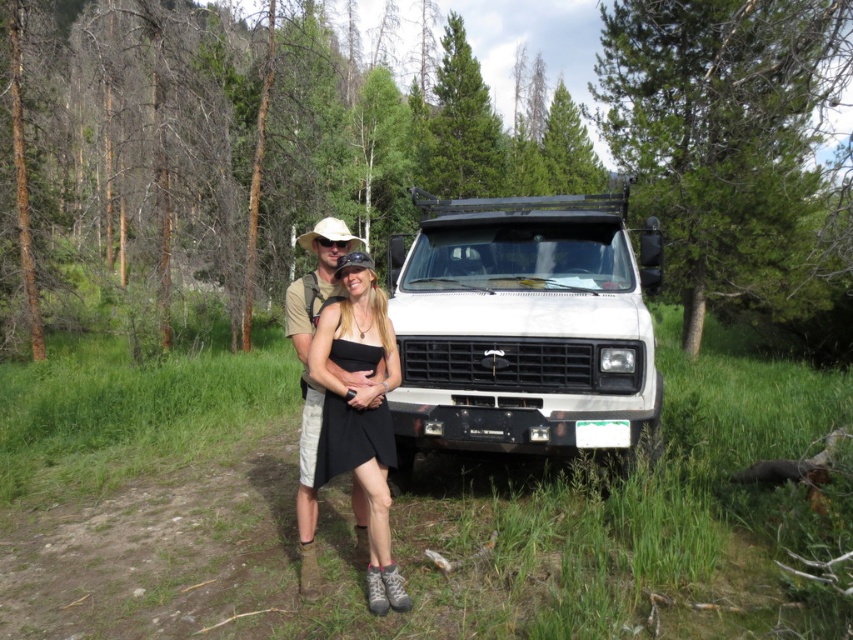
Question: Can you confirm if white matte suv at center is thinner than black satin dress at center?

Choices:
 (A) no
 (B) yes

Answer: (A)

Question: Among these points, which one is nearest to the camera?

Choices:
 (A) (x=383, y=301)
 (B) (x=494, y=221)

Answer: (A)

Question: Observing the image, what is the correct spatial positioning of white matte suv at center in reference to black satin dress at center?

Choices:
 (A) below
 (B) above

Answer: (B)

Question: In this image, where is white matte suv at center located relative to black satin dress at center?

Choices:
 (A) left
 (B) right

Answer: (B)

Question: Among these objects, which one is nearest to the camera?

Choices:
 (A) black satin dress at center
 (B) white matte suv at center

Answer: (A)